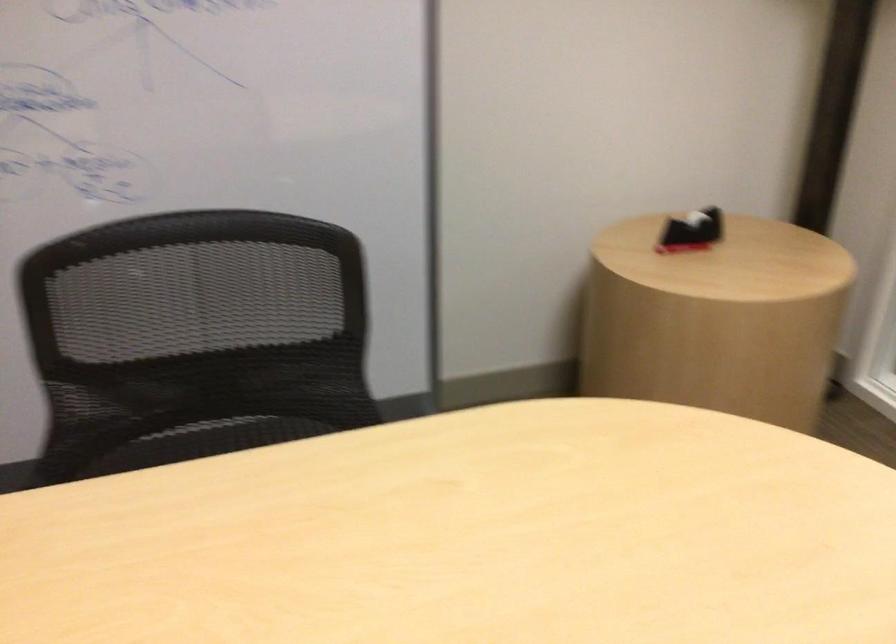
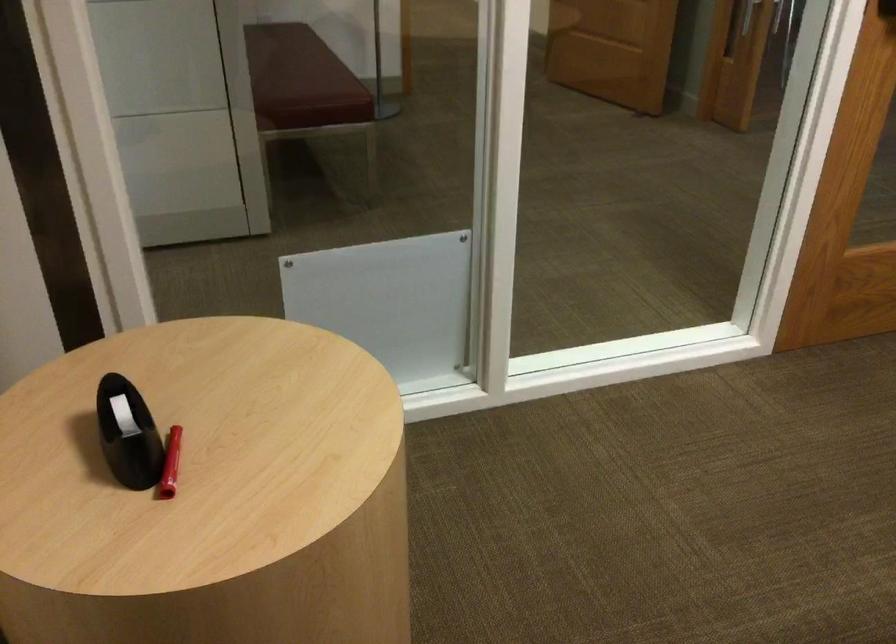
In the second image, find the point that corresponds to pixel 677 245 in the first image.

(170, 464)